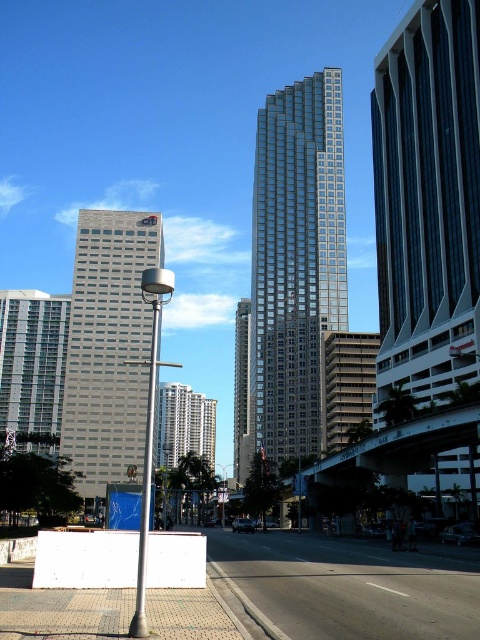
You are a drone operator planning to fly a drone between the gray concrete building at center and the white glass building at left. The drone has a wingspan of 1.5 meters. Based on the scene, can the drone safely navigate the space between them?

The distance between the gray concrete building at center and the white glass building at left is 16.79 meters. Since the drone has a wingspan of 1.5 meters, it can safely navigate the space between them as the distance is significantly larger than the drone size.